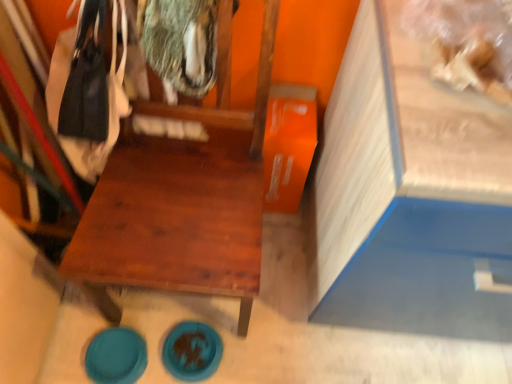
Locate an element on the screen. This screenshot has height=384, width=512. free space to the back side of blue matte plate at lower center, which is counted as the 2th plate, starting from the left is located at coordinates (193, 309).